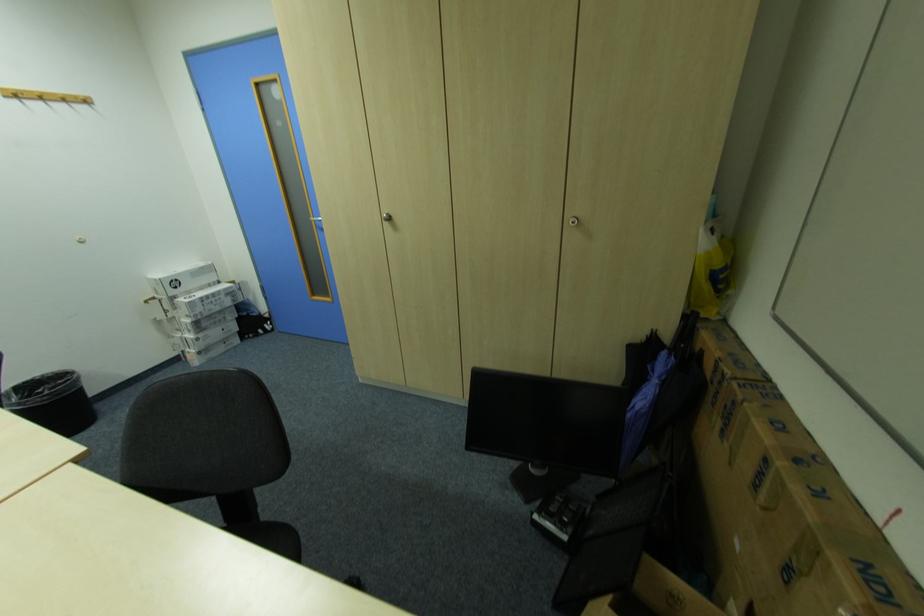
The image size is (924, 616). In order to click on yellow plastic bag in this screenshot , I will do `click(711, 272)`.